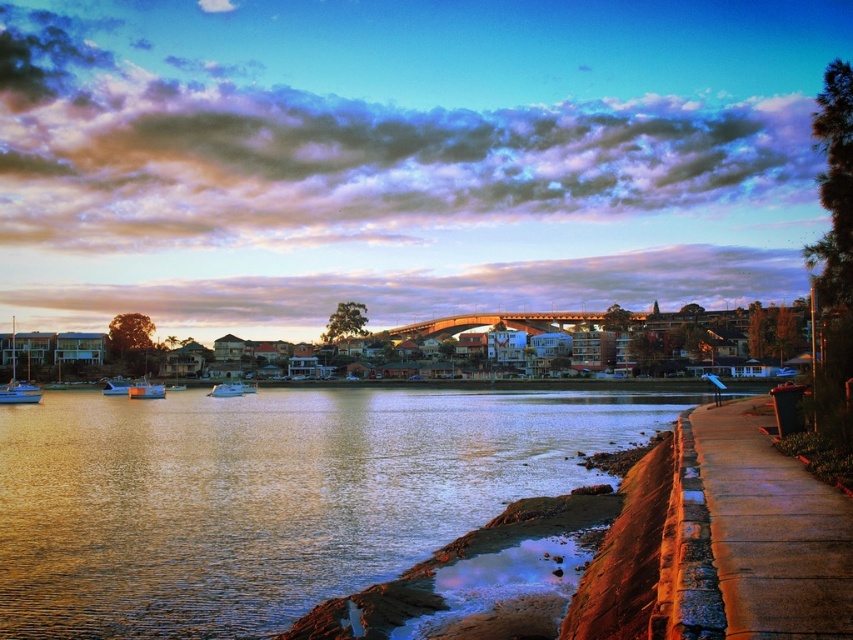
Question: Which object is farther from the camera taking this photo?

Choices:
 (A) blue plastic boat at center-left
 (B) matte white sailboat at left

Answer: (A)

Question: Which of the following is the closest to the observer?

Choices:
 (A) (103, 448)
 (B) (126, 392)
 (C) (13, 323)
 (D) (149, 394)

Answer: (A)

Question: Based on their relative distances, which object is nearer to the blue plastic boat at center-left?

Choices:
 (A) matte white sailboat at left
 (B) concrete sidewalk at lower right
 (C) golden reflective water at lower left
 (D) metallic silver boat at left

Answer: (D)

Question: Does metallic silver boat at left have a greater width compared to white glossy boat at left?

Choices:
 (A) yes
 (B) no

Answer: (A)

Question: Does blue plastic boat at center-left appear on the right side of white glossy boat at left?

Choices:
 (A) no
 (B) yes

Answer: (B)

Question: Considering the relative positions of blue plastic boat at center-left and white glossy boat at left in the image provided, where is blue plastic boat at center-left located with respect to white glossy boat at left?

Choices:
 (A) below
 (B) above

Answer: (B)